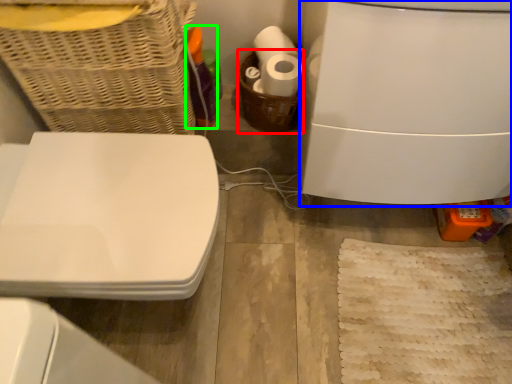
Question: Which object is the farthest from basket (highlighted by a red box)? Choose among these: appliance (highlighted by a blue box) or bottle (highlighted by a green box).

Choices:
 (A) appliance
 (B) bottle

Answer: (A)